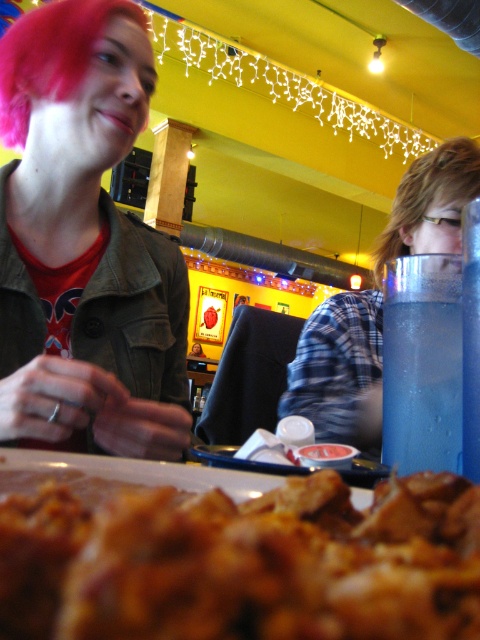
Question: Which point is closer to the camera?

Choices:
 (A) (320, 378)
 (B) (128, 573)
 (C) (10, 349)

Answer: (B)

Question: Does brown crispy pastry at center have a larger size compared to matte black jacket at upper left?

Choices:
 (A) yes
 (B) no

Answer: (B)

Question: Which object is the farthest from the matte black jacket at upper left?

Choices:
 (A) brown crispy pastry at center
 (B) blue glass at right

Answer: (A)

Question: Does matte black jacket at upper left appear over blue glass at right?

Choices:
 (A) no
 (B) yes

Answer: (A)

Question: Does brown crispy pastry at center come in front of matte black jacket at upper left?

Choices:
 (A) no
 (B) yes

Answer: (B)

Question: Which of the following is the farthest from the observer?

Choices:
 (A) (352, 525)
 (B) (117, 106)

Answer: (B)